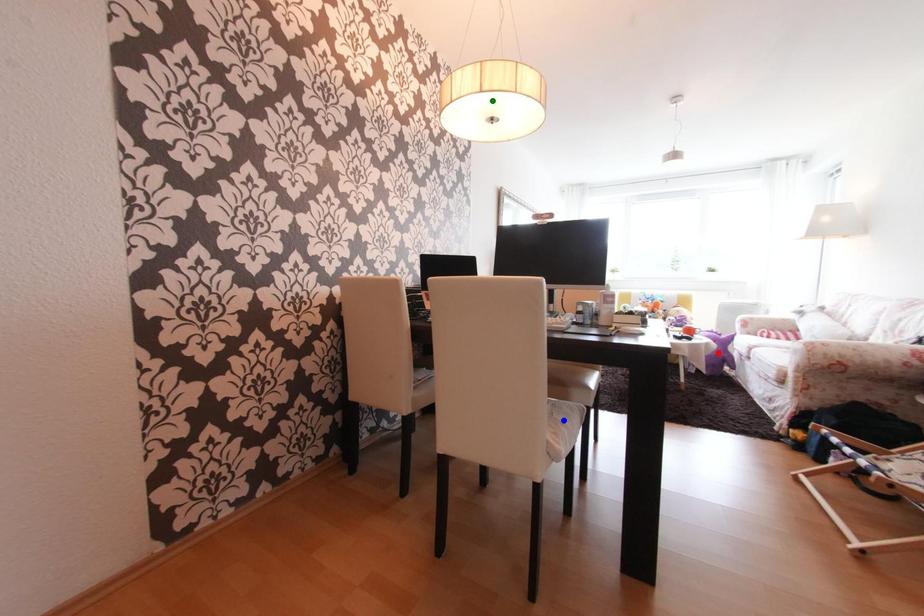
Order these from nearest to farthest:
green point | red point | blue point

blue point < green point < red point